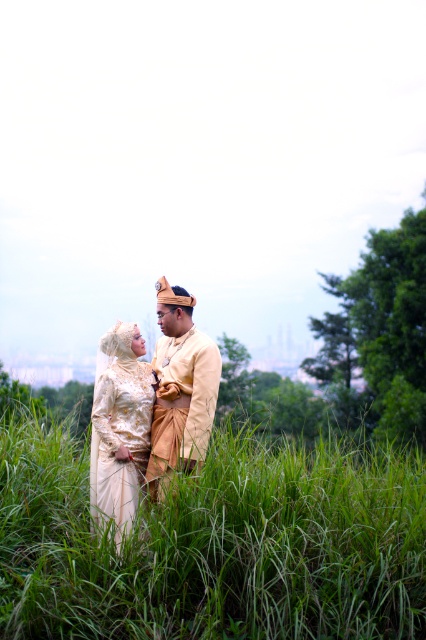
Which is above, green grassy at center or golden silk dress at center?

Positioned higher is golden silk dress at center.

The height and width of the screenshot is (640, 426). Find the location of `green grassy at center`. green grassy at center is located at coordinates (215, 545).

The width and height of the screenshot is (426, 640). Describe the element at coordinates (215, 545) in the screenshot. I see `green grassy at center` at that location.

Find the location of a particular element. The height and width of the screenshot is (640, 426). green grassy at center is located at coordinates pos(215,545).

Between golden silk dress at center and matte gold suit at center, which one is positioned lower?

golden silk dress at center is below.

Locate an element on the screen. This screenshot has width=426, height=640. golden silk dress at center is located at coordinates click(152, 406).

Which is above, green grassy at center or matte gold suit at center?

matte gold suit at center

The height and width of the screenshot is (640, 426). What do you see at coordinates (215, 545) in the screenshot?
I see `green grassy at center` at bounding box center [215, 545].

What do you see at coordinates (215, 545) in the screenshot? I see `green grassy at center` at bounding box center [215, 545].

The width and height of the screenshot is (426, 640). I want to click on green grassy at center, so click(215, 545).